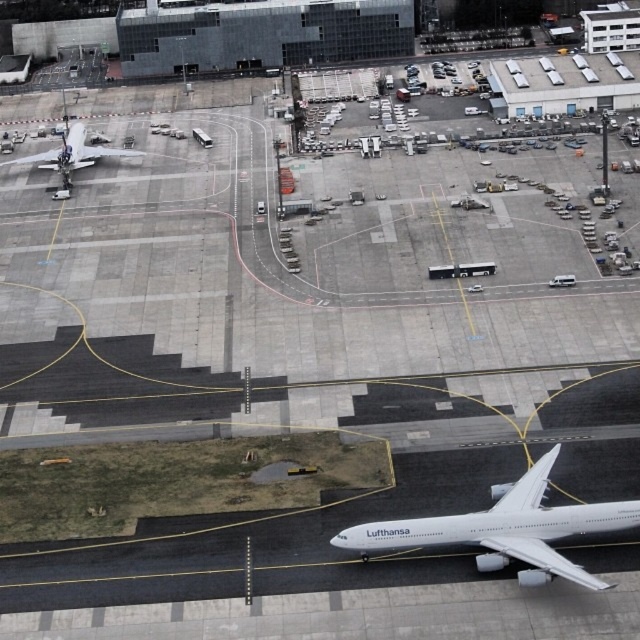
Is point (333, 8) more distant than point (102, 148)?

Yes, point (333, 8) is farther from viewer.

The image size is (640, 640). Identify the location of dark gray glass building at upper center. (260, 35).

Who is more distant from viewer, (x=365, y=10) or (x=99, y=145)?

Point (x=365, y=10)

The width and height of the screenshot is (640, 640). Identify the location of dark gray glass building at upper center. (260, 35).

Is the position of white matte airplane at lower right less distant than that of white glossy airplane at upper left?

Yes, white matte airplane at lower right is closer to the viewer.

Does point (557, 563) lie in front of point (44, 150)?

That is True.

Who is more forward, [513,508] or [61,129]?

Point [513,508] is more forward.

Find the location of `white matte airplane at lower right`. white matte airplane at lower right is located at coordinates (506, 529).

Between point (218, 4) and point (502, 547), which one is positioned behind?

Positioned behind is point (218, 4).

Can you confirm if dark gray glass building at upper center is positioned to the right of white matte airplane at lower right?

In fact, dark gray glass building at upper center is to the left of white matte airplane at lower right.

You are a GUI agent. You are given a task and a screenshot of the screen. Output one action in this format:
    pyautogui.click(x=<x>, y=<y>)
    Task: Click on the dark gray glass building at upper center
    The height and width of the screenshot is (640, 640).
    Given the screenshot: What is the action you would take?
    pyautogui.click(x=260, y=35)